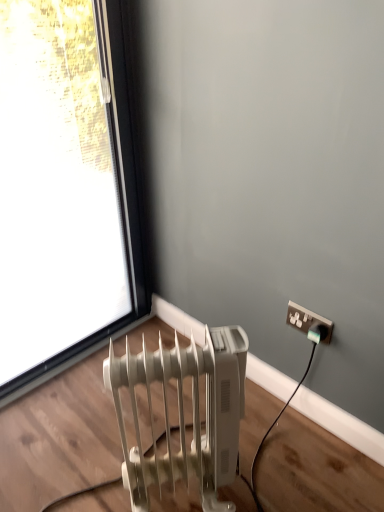
Identify the location of vacant area that is situated to the right of white plastic radiator at lower left. The image size is (384, 512). (274, 470).